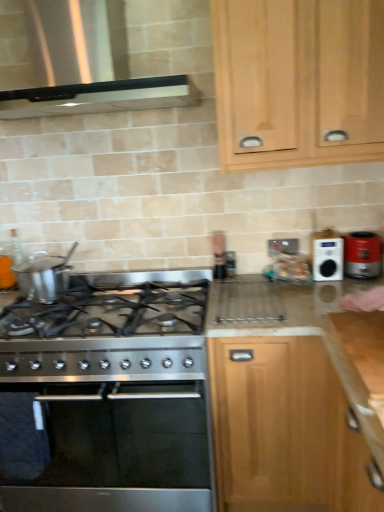
Question: From a real-world perspective, is matte red toaster at right physically located above or below light wood cabinet at upper right, the 2th cabinetry ordered from the bottom?

Choices:
 (A) above
 (B) below

Answer: (B)

Question: Considering the positions of point (357, 237) and point (296, 132), is point (357, 237) closer or farther from the camera than point (296, 132)?

Choices:
 (A) farther
 (B) closer

Answer: (A)

Question: Which is farther from the light wood cabinet at upper right, the 2th cabinetry ordered from the bottom?

Choices:
 (A) stainless steel gas stove at lower left
 (B) stainless steel vent at upper left
 (C) metallic silver outlet at upper center
 (D) light wood cabinet at center, placed as the first cabinetry when sorted from bottom to top
 (E) matte red toaster at right

Answer: (A)

Question: Which object is the farthest from the white plastic radio at upper right?

Choices:
 (A) stainless steel vent at upper left
 (B) stainless steel oven at lower left
 (C) metallic silver outlet at upper center
 (D) stainless steel gas stove at lower left
 (E) light wood cabinet at upper right, positioned as the first cabinetry in top-to-bottom order

Answer: (B)